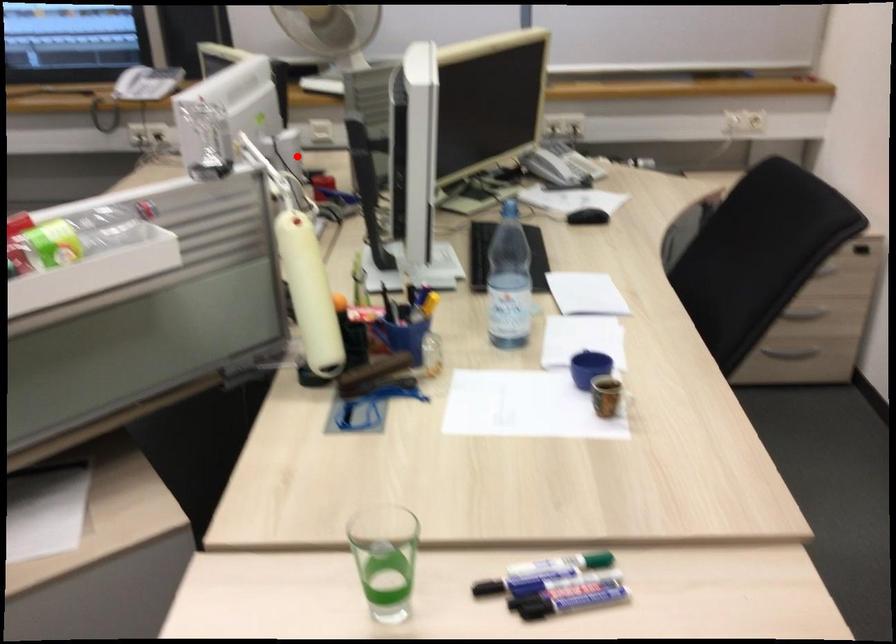
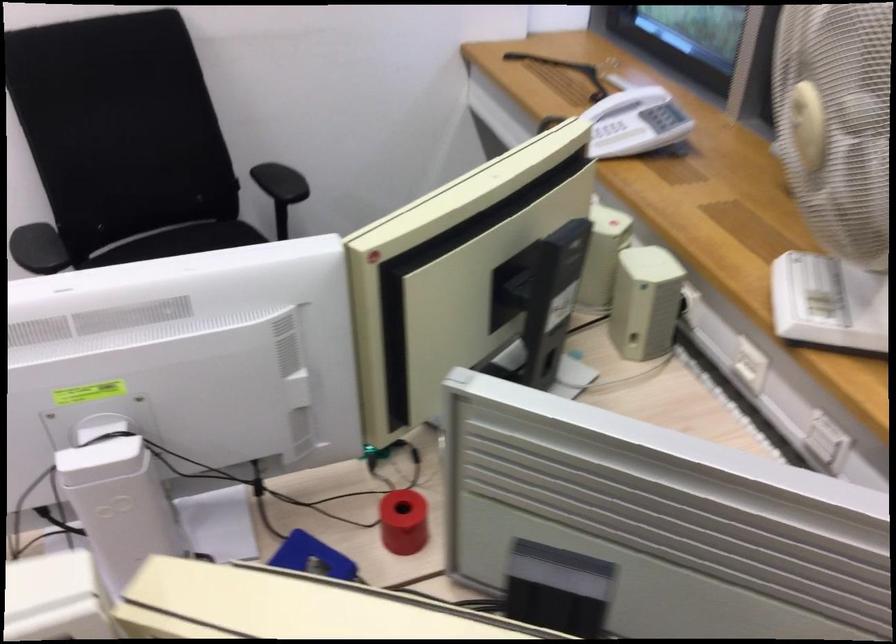
The point at the highlighted location is marked in the first image. Where is the corresponding point in the second image?

(118, 500)